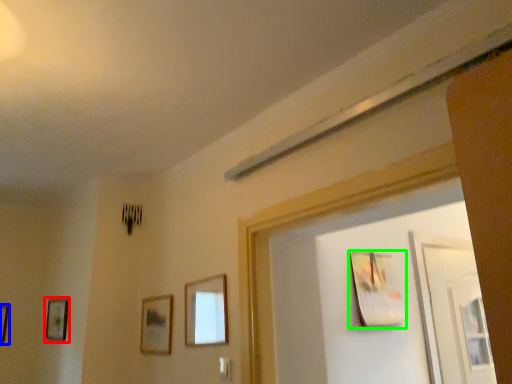
Question: Which is nearer to the picture frame (highlighted by a red box)? picture frame (highlighted by a blue box) or picture frame (highlighted by a green box).

Choices:
 (A) picture frame
 (B) picture frame

Answer: (A)